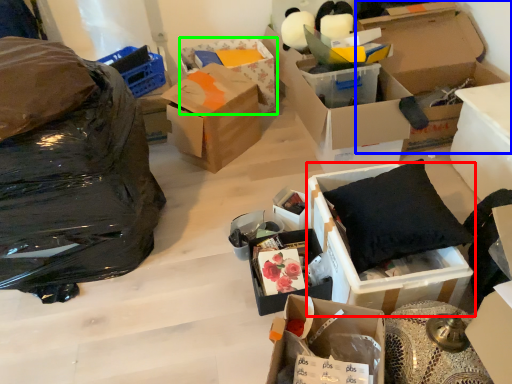
Question: Which object is the farthest from box (highlighted by a red box)? Choose among these: box (highlighted by a blue box) or box (highlighted by a green box).

Choices:
 (A) box
 (B) box

Answer: (B)